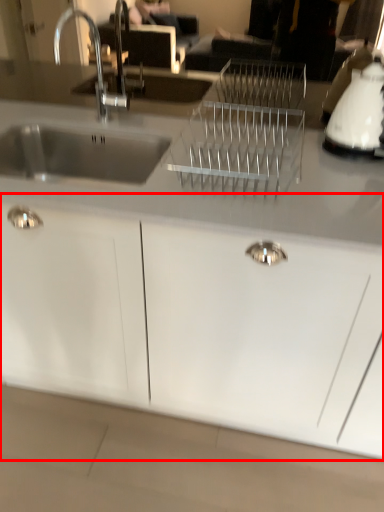
Question: Where is cabinetry (annotated by the red box) located in relation to appliance in the image?

Choices:
 (A) left
 (B) right

Answer: (A)